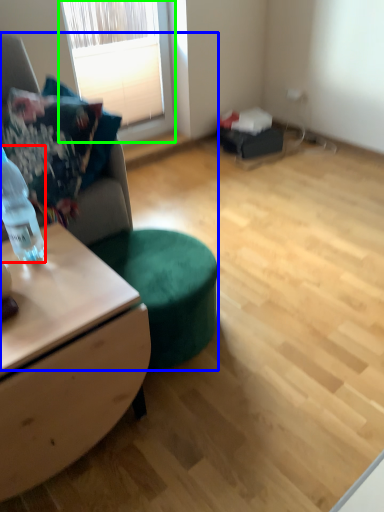
Question: Which object is the farthest from bottle (highlighted by a red box)? Choose among these: studio couch (highlighted by a blue box) or window (highlighted by a green box).

Choices:
 (A) studio couch
 (B) window

Answer: (B)